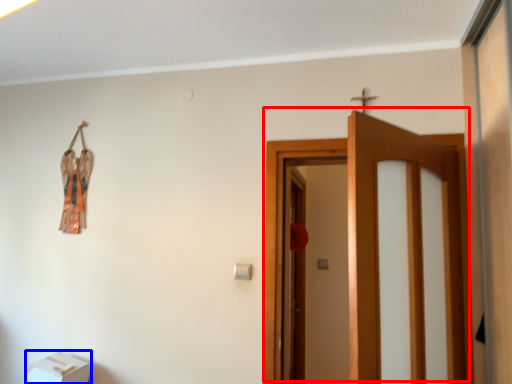
Question: Which point is closer to the camera, door (highlighted by a red box) or furniture (highlighted by a blue box)?

Choices:
 (A) door
 (B) furniture

Answer: (A)